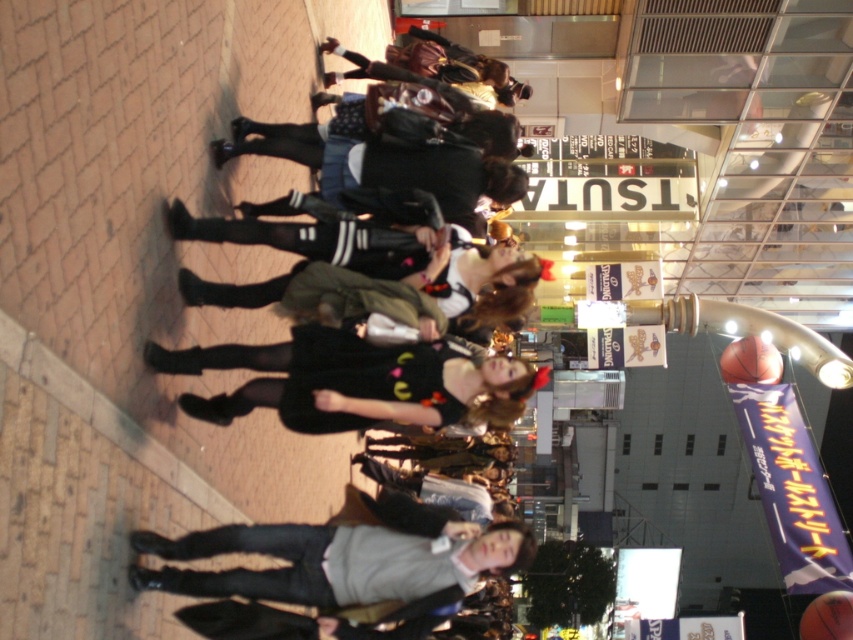
Between black leather jacket at center and rubber textured basketball at right, which one is positioned higher?

black leather jacket at center is above.

At what (x,y) coordinates should I click in order to perform the action: click on black leather jacket at center. Please return your answer as a coordinate pair (x, y). Image resolution: width=853 pixels, height=640 pixels. Looking at the image, I should click on (376, 227).

Is black leather jacket at center positioned before orange textured basketball at center?

Yes, black leather jacket at center is in front of orange textured basketball at center.

Which is below, black leather jacket at center or orange textured basketball at center?

orange textured basketball at center is lower down.

Does point (442, 365) come farther from viewer compared to point (822, 611)?

No.

In order to click on black leather jacket at center in this screenshot , I will do pyautogui.click(x=376, y=227).

Which is behind, point (734, 348) or point (836, 618)?

Point (734, 348)

Between rubber textured basketball at right and orange textured basketball at center, which one appears on the right side from the viewer's perspective?

orange textured basketball at center

Does point (723, 372) come in front of point (805, 627)?

No, (723, 372) is further to viewer.

You are a GUI agent. You are given a task and a screenshot of the screen. Output one action in this format:
    pyautogui.click(x=<x>, y=<y>)
    Task: Click on the rubber textured basketball at right
    The image size is (853, 640).
    Given the screenshot: What is the action you would take?
    pyautogui.click(x=750, y=362)